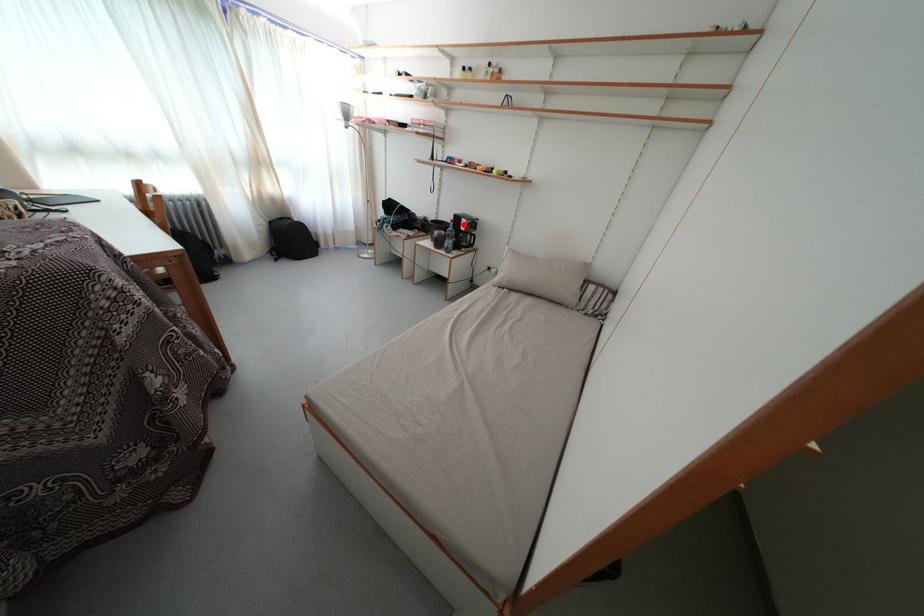
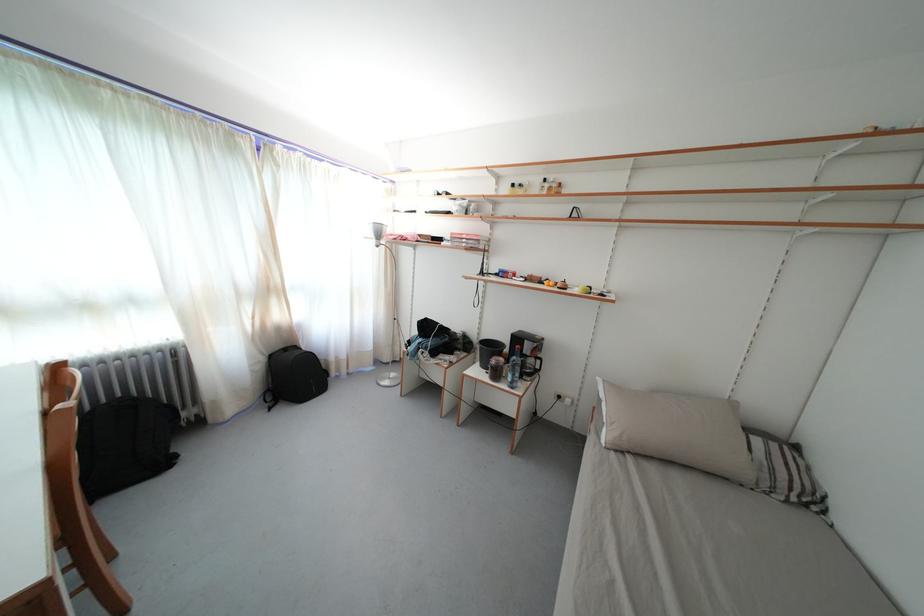
In the second image, find the point that corresponds to the highlighted location in the first image.

(524, 345)